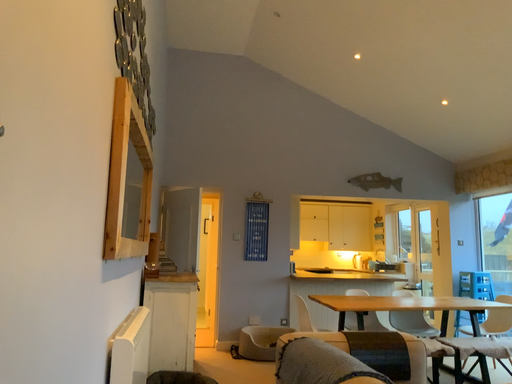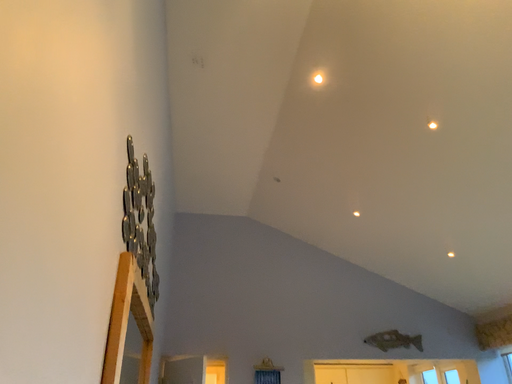
Question: How did the camera likely rotate when shooting the video?

Choices:
 (A) rotated downward
 (B) rotated upward

Answer: (B)